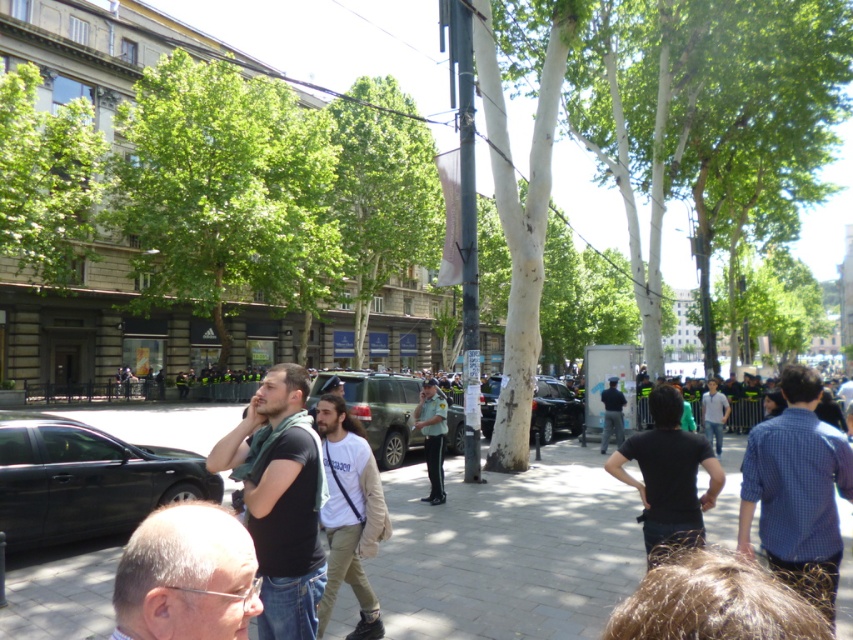
Is blue checkered shirt at center behind dark blue uniform at center?

That is False.

Is blue checkered shirt at center closer to camera compared to dark blue uniform at center?

Yes, it is.

You are a GUI agent. You are given a task and a screenshot of the screen. Output one action in this format:
    pyautogui.click(x=<x>, y=<y>)
    Task: Click on the blue checkered shirt at center
    
    Given the screenshot: What is the action you would take?
    pyautogui.click(x=798, y=490)

This screenshot has height=640, width=853. I want to click on blue checkered shirt at center, so 798,490.

Between matte black suv at center and shiny black suv at center, which one appears on the left side from the viewer's perspective?

Positioned to the left is matte black suv at center.

Does matte black suv at center have a greater height compared to shiny black suv at center?

Yes.

What do you see at coordinates (378, 410) in the screenshot? I see `matte black suv at center` at bounding box center [378, 410].

The height and width of the screenshot is (640, 853). In order to click on matte black suv at center in this screenshot , I will do `click(378, 410)`.

Is point (582, 419) positioned after point (606, 442)?

Yes, it is behind point (606, 442).

Is point (575, 396) farther from camera compared to point (607, 392)?

Yes, it is.

What are the coordinates of `shiny black suv at center` in the screenshot? It's located at (553, 410).